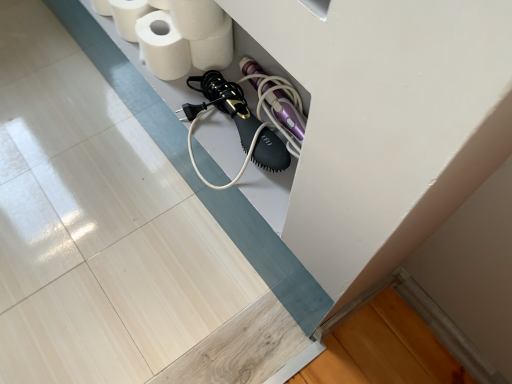
Identify the location of white matte toilet paper at upper left, positioned as the 1th toilet paper in left-to-right order. (128, 16).

The width and height of the screenshot is (512, 384). I want to click on white matte toilet paper at upper center, arranged as the 1th toilet paper when viewed from the right, so click(x=214, y=48).

Identify the location of white matte toilet paper at upper left, which appears as the 4th toilet paper when viewed from the right. The image size is (512, 384). coord(128,16).

Does white matte toilet paper at upper center, placed as the second toilet paper when sorted from right to left, come in front of white matte toilet paper at upper center, arranged as the 1th toilet paper when viewed from the right?

Yes, white matte toilet paper at upper center, placed as the second toilet paper when sorted from right to left, is closer to the camera.

I want to click on the 3rd toilet paper positioned above the white matte toilet paper at upper center, arranged as the 1th toilet paper when viewed from the right (from a real-world perspective), so click(196, 18).

Is white matte toilet paper at upper center, which ranks as the 3th toilet paper in left-to-right order, touching white matte toilet paper at upper center, arranged as the 1th toilet paper when viewed from the right?

Indeed, white matte toilet paper at upper center, which ranks as the 3th toilet paper in left-to-right order, and white matte toilet paper at upper center, arranged as the 1th toilet paper when viewed from the right, are beside each other and touching.

How many degrees apart are the facing directions of white matte toilet paper at upper center, which ranks as the 3th toilet paper in left-to-right order, and white matte toilet paper at upper left, the 3th toilet paper positioned from the right?

The facing directions of white matte toilet paper at upper center, which ranks as the 3th toilet paper in left-to-right order, and white matte toilet paper at upper left, the 3th toilet paper positioned from the right, are 0.00031 degrees apart.

Looking at this image, from the image's perspective, which one is positioned lower, white matte toilet paper at upper center, which ranks as the 3th toilet paper in left-to-right order, or white matte toilet paper at upper left, which ranks as the second toilet paper in left-to-right order?

white matte toilet paper at upper left, which ranks as the second toilet paper in left-to-right order, appears lower in the image.

Between white matte toilet paper at upper center, placed as the second toilet paper when sorted from right to left, and white matte toilet paper at upper left, which ranks as the second toilet paper in left-to-right order, which one has less height?

white matte toilet paper at upper left, which ranks as the second toilet paper in left-to-right order.

From the image's perspective, would you say white matte toilet paper at upper left, which ranks as the second toilet paper in left-to-right order, is positioned over white matte toilet paper at upper center, which ranks as the 3th toilet paper in left-to-right order?

Actually, white matte toilet paper at upper left, which ranks as the second toilet paper in left-to-right order, appears below white matte toilet paper at upper center, which ranks as the 3th toilet paper in left-to-right order, in the image.

Can you confirm if white matte toilet paper at upper left, which ranks as the second toilet paper in left-to-right order, is positioned to the right of white matte toilet paper at upper center, placed as the second toilet paper when sorted from right to left?

No, white matte toilet paper at upper left, which ranks as the second toilet paper in left-to-right order, is not to the right of white matte toilet paper at upper center, placed as the second toilet paper when sorted from right to left.

Measure the distance from white matte toilet paper at upper left, which ranks as the second toilet paper in left-to-right order, to white matte toilet paper at upper center, placed as the second toilet paper when sorted from right to left.

The distance of white matte toilet paper at upper left, which ranks as the second toilet paper in left-to-right order, from white matte toilet paper at upper center, placed as the second toilet paper when sorted from right to left, is 2.70 inches.

Considering the sizes of objects white matte toilet paper at upper center, arranged as the 1th toilet paper when viewed from the right, and white matte toilet paper at upper center, which ranks as the 3th toilet paper in left-to-right order, in the image provided, who is wider, white matte toilet paper at upper center, arranged as the 1th toilet paper when viewed from the right, or white matte toilet paper at upper center, which ranks as the 3th toilet paper in left-to-right order,?

white matte toilet paper at upper center, which ranks as the 3th toilet paper in left-to-right order, is wider.

From the image's perspective, is white matte toilet paper at upper center, arranged as the 1th toilet paper when viewed from the right, located beneath white matte toilet paper at upper center, which ranks as the 3th toilet paper in left-to-right order?

Yes, from the image's perspective, white matte toilet paper at upper center, arranged as the 1th toilet paper when viewed from the right, is below white matte toilet paper at upper center, which ranks as the 3th toilet paper in left-to-right order.

Is white matte toilet paper at upper center, arranged as the 1th toilet paper when viewed from the right, inside or outside of white matte toilet paper at upper center, placed as the second toilet paper when sorted from right to left?

white matte toilet paper at upper center, arranged as the 1th toilet paper when viewed from the right, exists outside the volume of white matte toilet paper at upper center, placed as the second toilet paper when sorted from right to left.

Are white matte toilet paper at upper center, arranged as the 1th toilet paper when viewed from the right, and white matte toilet paper at upper center, placed as the second toilet paper when sorted from right to left, located far from each other?

No.

Relative to white matte toilet paper at upper center, arranged as the 1th toilet paper when viewed from the right, is white matte toilet paper at upper left, which ranks as the second toilet paper in left-to-right order, in front or behind?

Clearly, white matte toilet paper at upper left, which ranks as the second toilet paper in left-to-right order, is in front of white matte toilet paper at upper center, arranged as the 1th toilet paper when viewed from the right.

Is white matte toilet paper at upper left, the 3th toilet paper positioned from the right, shorter than white matte toilet paper at upper center, which is the fourth toilet paper from left to right?

Indeed, white matte toilet paper at upper left, the 3th toilet paper positioned from the right, has a lesser height compared to white matte toilet paper at upper center, which is the fourth toilet paper from left to right.

From a real-world perspective, is white matte toilet paper at upper left, which ranks as the second toilet paper in left-to-right order, above or below white matte toilet paper at upper center, which is the fourth toilet paper from left to right?

In terms of real-world spatial position, white matte toilet paper at upper left, which ranks as the second toilet paper in left-to-right order, is above white matte toilet paper at upper center, which is the fourth toilet paper from left to right.

Is white matte toilet paper at upper center, which is the fourth toilet paper from left to right, at the back of white matte toilet paper at upper left, the 3th toilet paper positioned from the right?

Correct, white matte toilet paper at upper left, the 3th toilet paper positioned from the right, is looking away from white matte toilet paper at upper center, which is the fourth toilet paper from left to right.

What's the angular difference between white matte toilet paper at upper left, which ranks as the second toilet paper in left-to-right order, and white matte toilet paper at upper left, which appears as the 4th toilet paper when viewed from the right,'s facing directions?

0.000471 degrees.

Identify the location of toilet paper that is the 2nd one when counting forward from the white matte toilet paper at upper left, positioned as the 1th toilet paper in left-to-right order. (162, 46).

Is white matte toilet paper at upper left, which ranks as the second toilet paper in left-to-right order, oriented away from white matte toilet paper at upper left, positioned as the 1th toilet paper in left-to-right order?

No, white matte toilet paper at upper left, which ranks as the second toilet paper in left-to-right order, is not facing away from white matte toilet paper at upper left, positioned as the 1th toilet paper in left-to-right order.

Is white matte toilet paper at upper left, which appears as the 4th toilet paper when viewed from the right, looking in the opposite direction of white matte toilet paper at upper center, arranged as the 1th toilet paper when viewed from the right?

white matte toilet paper at upper left, which appears as the 4th toilet paper when viewed from the right, is not turned away from white matte toilet paper at upper center, arranged as the 1th toilet paper when viewed from the right.

Considering the relative sizes of white matte toilet paper at upper left, positioned as the 1th toilet paper in left-to-right order, and white matte toilet paper at upper center, arranged as the 1th toilet paper when viewed from the right, in the image provided, is white matte toilet paper at upper left, positioned as the 1th toilet paper in left-to-right order, bigger than white matte toilet paper at upper center, arranged as the 1th toilet paper when viewed from the right,?

Yes, white matte toilet paper at upper left, positioned as the 1th toilet paper in left-to-right order, is bigger than white matte toilet paper at upper center, arranged as the 1th toilet paper when viewed from the right.

Could you measure the distance between white matte toilet paper at upper left, which appears as the 4th toilet paper when viewed from the right, and white matte toilet paper at upper center, arranged as the 1th toilet paper when viewed from the right?

white matte toilet paper at upper left, which appears as the 4th toilet paper when viewed from the right, is 6.70 inches away from white matte toilet paper at upper center, arranged as the 1th toilet paper when viewed from the right.

Would you say white matte toilet paper at upper left, which appears as the 4th toilet paper when viewed from the right, is a long distance from white matte toilet paper at upper center, which is the fourth toilet paper from left to right?

That's not correct — white matte toilet paper at upper left, which appears as the 4th toilet paper when viewed from the right, is a little close to white matte toilet paper at upper center, which is the fourth toilet paper from left to right.

Which toilet paper is the 2nd one when counting from the back of the white matte toilet paper at upper center, placed as the second toilet paper when sorted from right to left? Please provide its 2D coordinates.

[(214, 48)]

Identify the location of the 1st toilet paper to the left of the white matte toilet paper at upper center, placed as the second toilet paper when sorted from right to left, starting your count from the anchor. This screenshot has width=512, height=384. (162, 46).

Estimate the real-world distances between objects in this image. Which object is closer to white matte toilet paper at upper center, placed as the second toilet paper when sorted from right to left, white matte toilet paper at upper left, which appears as the 4th toilet paper when viewed from the right, or white matte toilet paper at upper left, the 3th toilet paper positioned from the right?

Based on the image, white matte toilet paper at upper left, the 3th toilet paper positioned from the right, appears to be nearer to white matte toilet paper at upper center, placed as the second toilet paper when sorted from right to left.

Considering their positions, is white matte toilet paper at upper center, placed as the second toilet paper when sorted from right to left, positioned closer to white matte toilet paper at upper left, which ranks as the second toilet paper in left-to-right order, than white matte toilet paper at upper left, which appears as the 4th toilet paper when viewed from the right?

white matte toilet paper at upper center, placed as the second toilet paper when sorted from right to left, is closer to white matte toilet paper at upper left, which ranks as the second toilet paper in left-to-right order.

Based on their spatial positions, is white matte toilet paper at upper center, which ranks as the 3th toilet paper in left-to-right order, or white matte toilet paper at upper left, the 3th toilet paper positioned from the right, further from white matte toilet paper at upper left, which appears as the 4th toilet paper when viewed from the right?

white matte toilet paper at upper center, which ranks as the 3th toilet paper in left-to-right order.

Which object lies nearer to the anchor point white matte toilet paper at upper center, placed as the second toilet paper when sorted from right to left, white matte toilet paper at upper center, which is the fourth toilet paper from left to right, or white matte toilet paper at upper left, which ranks as the second toilet paper in left-to-right order?

white matte toilet paper at upper center, which is the fourth toilet paper from left to right, is positioned closer to the anchor white matte toilet paper at upper center, placed as the second toilet paper when sorted from right to left.

Estimate the real-world distances between objects in this image. Which object is further from white matte toilet paper at upper left, positioned as the 1th toilet paper in left-to-right order, white matte toilet paper at upper center, arranged as the 1th toilet paper when viewed from the right, or white matte toilet paper at upper center, which ranks as the 3th toilet paper in left-to-right order?

Based on the image, white matte toilet paper at upper center, arranged as the 1th toilet paper when viewed from the right, appears to be further to white matte toilet paper at upper left, positioned as the 1th toilet paper in left-to-right order.

From the image, which object appears to be farther from white matte toilet paper at upper left, which ranks as the second toilet paper in left-to-right order, white matte toilet paper at upper center, which is the fourth toilet paper from left to right, or white matte toilet paper at upper center, which ranks as the 3th toilet paper in left-to-right order?

white matte toilet paper at upper center, which ranks as the 3th toilet paper in left-to-right order, is positioned further to the anchor white matte toilet paper at upper left, which ranks as the second toilet paper in left-to-right order.

Looking at the image, which one is located further to white matte toilet paper at upper center, which is the fourth toilet paper from left to right, white matte toilet paper at upper center, placed as the second toilet paper when sorted from right to left, or white matte toilet paper at upper left, which appears as the 4th toilet paper when viewed from the right?

Based on the image, white matte toilet paper at upper left, which appears as the 4th toilet paper when viewed from the right, appears to be further to white matte toilet paper at upper center, which is the fourth toilet paper from left to right.

Considering their positions, is white matte toilet paper at upper left, which appears as the 4th toilet paper when viewed from the right, positioned further to white matte toilet paper at upper left, which ranks as the second toilet paper in left-to-right order, than white matte toilet paper at upper center, placed as the second toilet paper when sorted from right to left?

Based on the image, white matte toilet paper at upper left, which appears as the 4th toilet paper when viewed from the right, appears to be further to white matte toilet paper at upper left, which ranks as the second toilet paper in left-to-right order.

This screenshot has width=512, height=384. I want to click on toilet paper positioned between white matte toilet paper at upper center, placed as the second toilet paper when sorted from right to left, and white matte toilet paper at upper center, which is the fourth toilet paper from left to right, from near to far, so click(162, 46).

The width and height of the screenshot is (512, 384). What are the coordinates of `toilet paper between white matte toilet paper at upper left, positioned as the 1th toilet paper in left-to-right order, and white matte toilet paper at upper center, which ranks as the 3th toilet paper in left-to-right order, from left to right` in the screenshot? It's located at (162, 46).